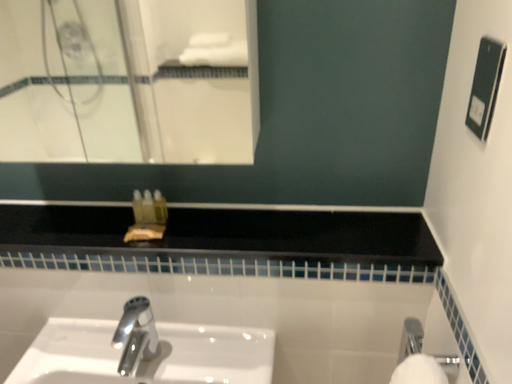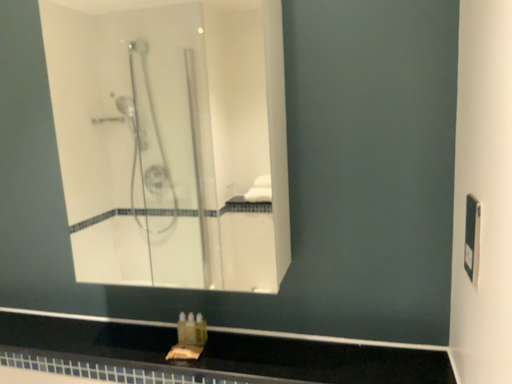
Question: Which way did the camera rotate in the video?

Choices:
 (A) rotated right
 (B) rotated left

Answer: (B)